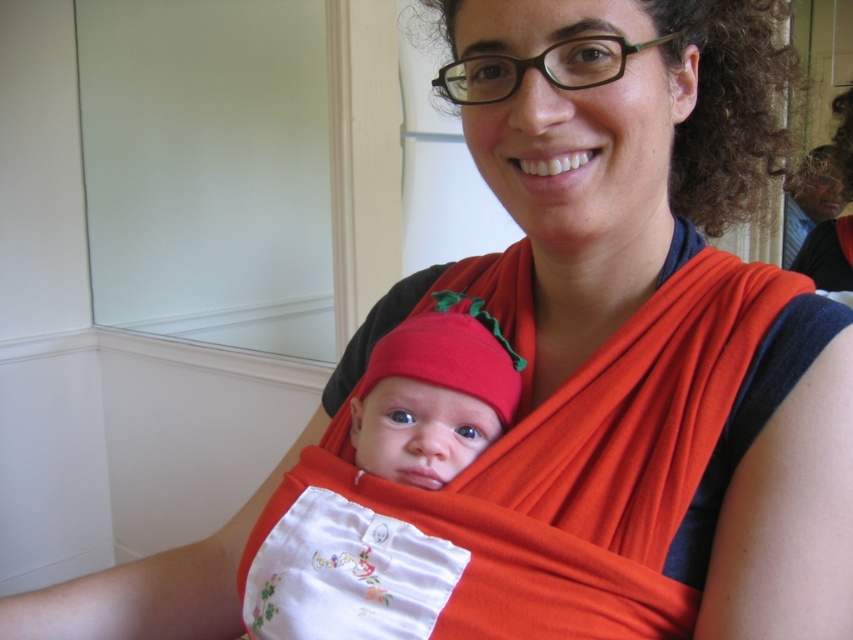
Based on the coordinates provided in the scene, where is the white embroidered bib at center located?

The white embroidered bib at center is located at point coordinates of 0.755 on the x axis and 0.626 on the y axis.

You are a photographer adjusting your camera to focus on two points in the image. The first point is point (322,497) and the second is point (390,406). Which point is closer to the camera?

Point (322,497) is further to the viewer than point (390,406), so the second point is closer to the camera.